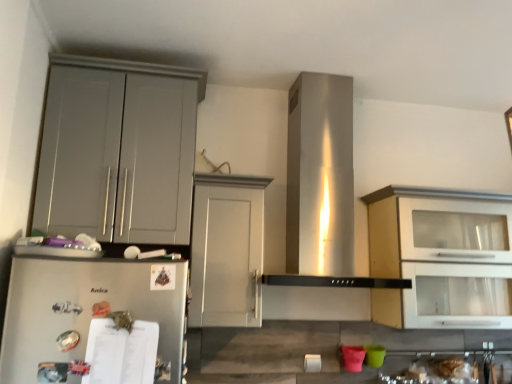
Question: Is satin silver refrigerator at lower left bigger or smaller than matte gray cabinet at left, arranged as the 3th cabinetry when viewed from the right?

Choices:
 (A) big
 (B) small

Answer: (B)

Question: Is satin silver refrigerator at lower left taller or shorter than matte gray cabinet at left, which ranks as the first cabinetry in left-to-right order?

Choices:
 (A) tall
 (B) short

Answer: (B)

Question: Estimate the real-world distances between objects in this image. Which object is farther from the matte gray cabinet at left, which ranks as the first cabinetry in left-to-right order?

Choices:
 (A) satin silver refrigerator at lower left
 (B) white glossy cabinet at upper right, marked as the 1th cabinetry in a right-to-left arrangement
 (C) white matte cabinet at center, marked as the second cabinetry in a left-to-right arrangement

Answer: (B)

Question: Which object is the farthest from the white matte cabinet at center, the second cabinetry in the right-to-left sequence?

Choices:
 (A) matte gray cabinet at left, arranged as the 3th cabinetry when viewed from the right
 (B) white glossy cabinet at upper right, marked as the 1th cabinetry in a right-to-left arrangement
 (C) satin silver refrigerator at lower left

Answer: (B)